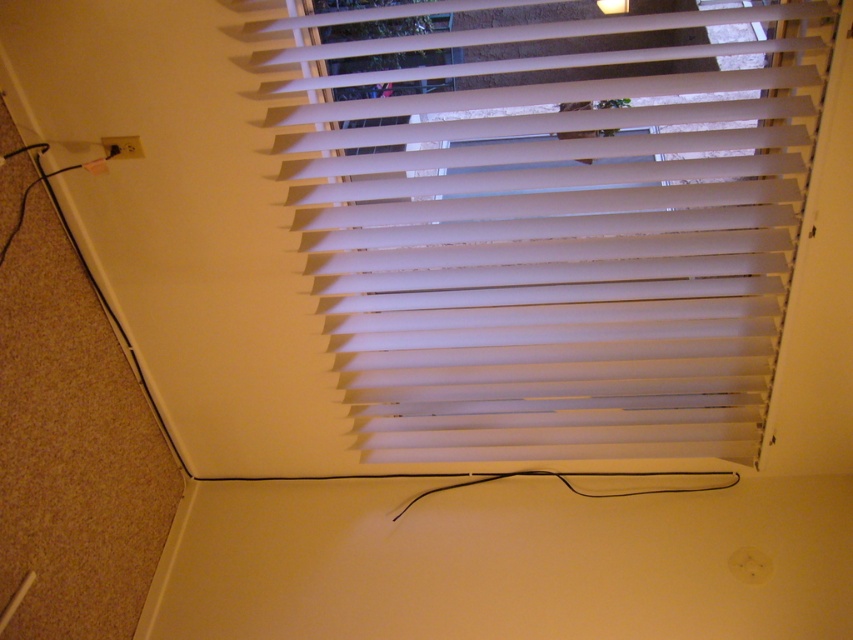
Question: Which object is positioned closest to the white plastic lampshade at upper center?

Choices:
 (A) black plastic plug at upper left
 (B) white matte blinds at upper center

Answer: (B)

Question: Which of the following is the closest to the observer?

Choices:
 (A) (608, 1)
 (B) (109, 147)

Answer: (A)

Question: Does white matte blinds at upper center have a larger size compared to white plastic lampshade at upper center?

Choices:
 (A) yes
 (B) no

Answer: (A)

Question: Does white matte blinds at upper center have a lesser width compared to black plastic plug at upper left?

Choices:
 (A) yes
 (B) no

Answer: (B)

Question: Among these points, which one is farthest from the camera?

Choices:
 (A) (606, 6)
 (B) (103, 148)

Answer: (B)

Question: Does white matte blinds at upper center have a larger size compared to black plastic plug at upper left?

Choices:
 (A) yes
 (B) no

Answer: (A)